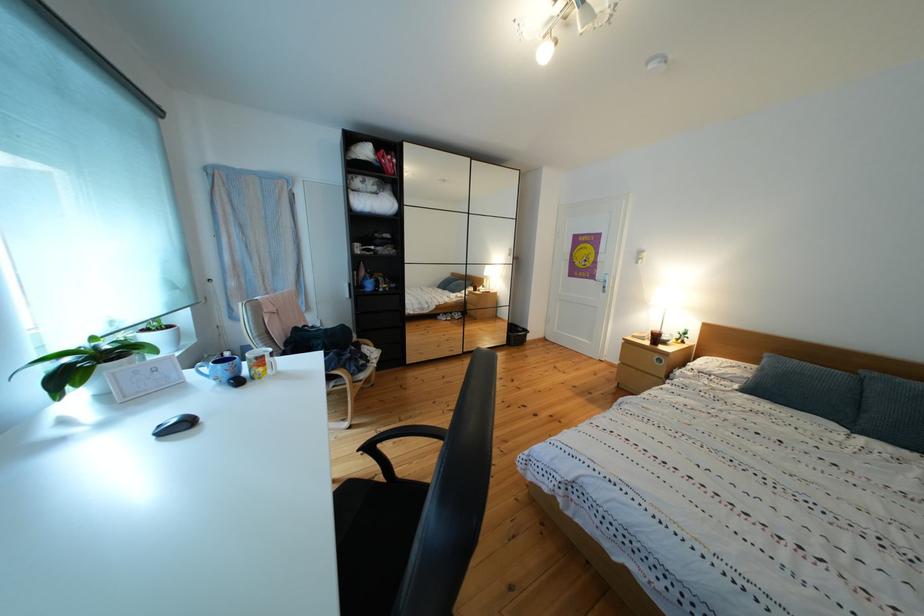
Locate an element on the screen. multicolored mug handle is located at coordinates (271, 360).